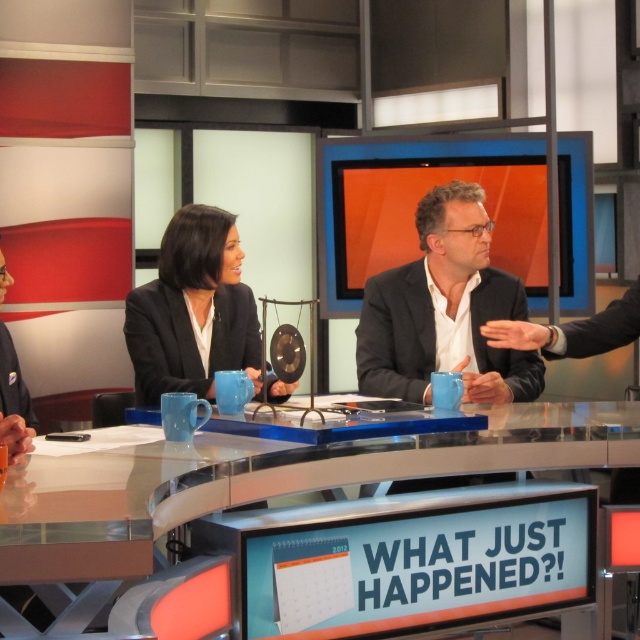
Question: Is dark gray suit at center bigger than dark gray fabric business suit at left?

Choices:
 (A) no
 (B) yes

Answer: (B)

Question: Which of the following is the closest to the observer?

Choices:
 (A) dark gray fabric business suit at left
 (B) dark gray suit at center

Answer: (A)

Question: Which point is closer to the camera?

Choices:
 (A) dark gray fabric business suit at left
 (B) dark gray suit at center
 (C) clear glass table at center
 (D) black matte business suit at center

Answer: (C)

Question: Which of these objects is positioned farthest from the dark gray fabric business suit at left?

Choices:
 (A) dark gray suit at center
 (B) clear glass table at center
 (C) black matte business suit at center

Answer: (A)

Question: In this image, where is dark gray suit at center located relative to black matte business suit at center?

Choices:
 (A) left
 (B) right

Answer: (B)

Question: Does clear glass table at center have a larger size compared to black matte business suit at center?

Choices:
 (A) yes
 (B) no

Answer: (A)